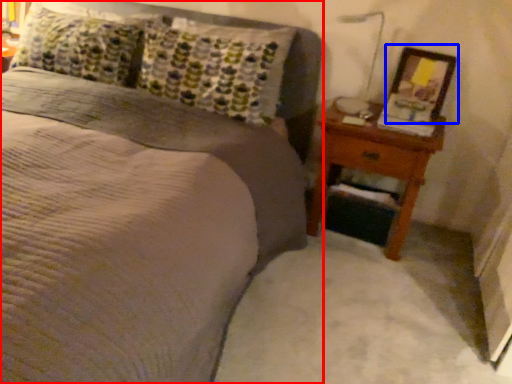
Question: Which of the following is the closest to the observer, bed (highlighted by a red box) or picture frame (highlighted by a blue box)?

Choices:
 (A) bed
 (B) picture frame

Answer: (A)